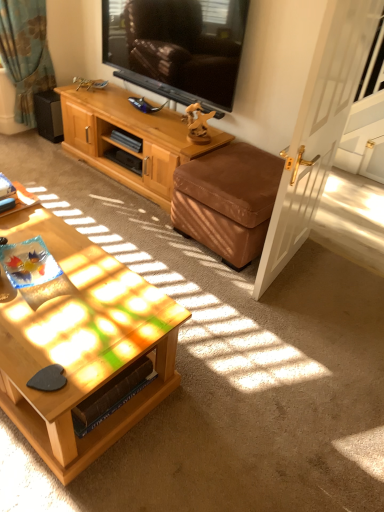
Identify the location of spots to the right of white glossy door at right. (334, 271).